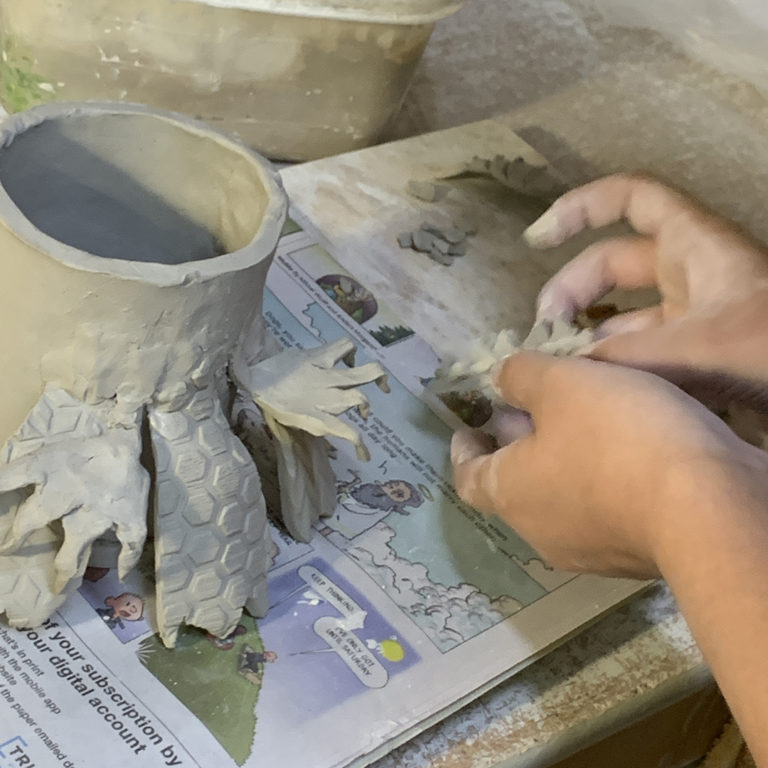
I want to click on bowl, so click(283, 55).